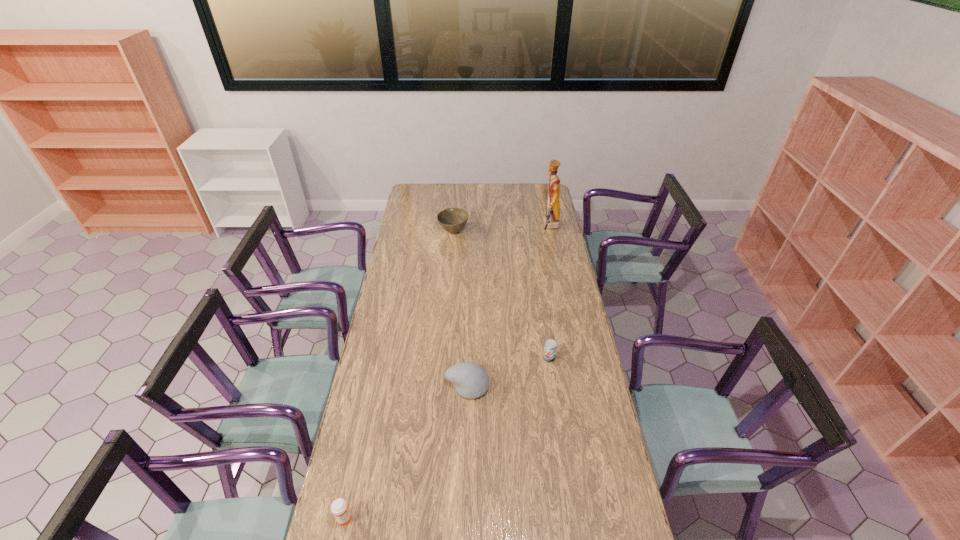
In order to click on nutcracker in this screenshot , I will do `click(551, 221)`.

You are a GUI agent. You are given a task and a screenshot of the screen. Output one action in this format:
    pyautogui.click(x=<x>, y=<y>)
    Task: Click on the tallest object
    The width and height of the screenshot is (960, 540).
    Given the screenshot: What is the action you would take?
    pyautogui.click(x=551, y=221)

This screenshot has width=960, height=540. Find the location of `bowl`. bowl is located at coordinates (452, 220).

Find the location of a particular element. The height and width of the screenshot is (540, 960). beanie is located at coordinates (471, 381).

The width and height of the screenshot is (960, 540). In order to click on medicine in this screenshot , I will do `click(340, 508)`.

Identify the location of the leftmost object. The height and width of the screenshot is (540, 960). (340, 508).

The image size is (960, 540). I want to click on beer can, so click(x=550, y=347).

Locate an element on the screen. the second object from right to left is located at coordinates (550, 347).

Where is `vacant space located on the front-facing side of the rightmost object`? The height and width of the screenshot is (540, 960). vacant space located on the front-facing side of the rightmost object is located at coordinates (500, 227).

Identify the location of free space located on the front-facing side of the rightmost object. (516, 227).